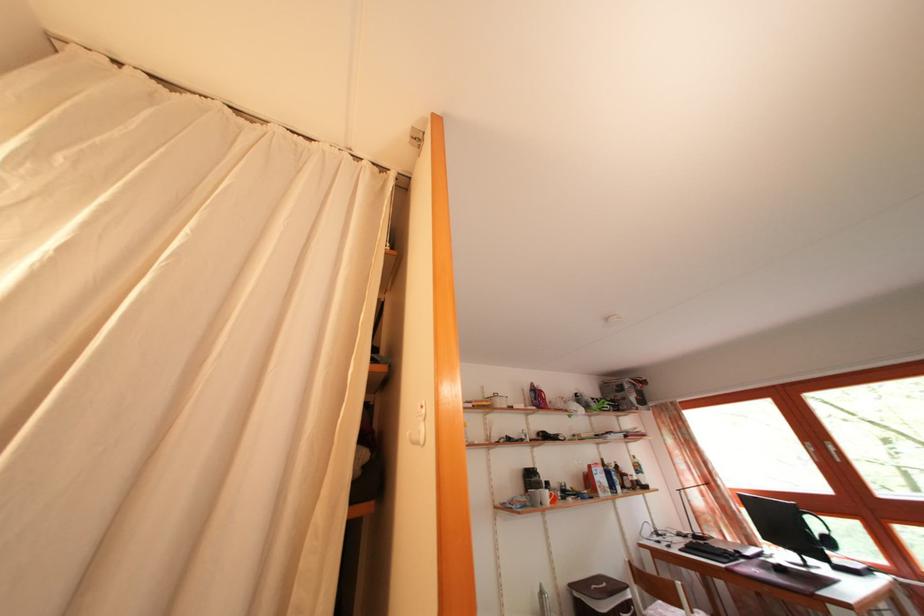
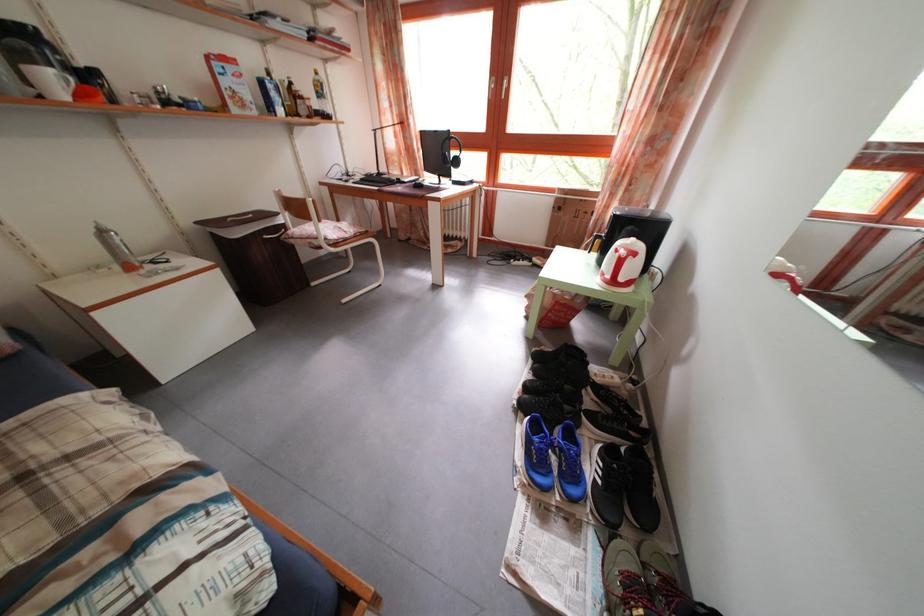
Where in the second image is the point corresponding to [736,546] from the first image?

(412, 182)